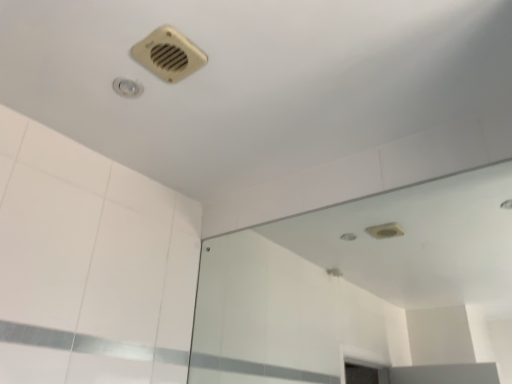
Question: Does transparent glass mirror at upper center have a lesser height compared to beige plastic air conditioning at upper center?

Choices:
 (A) yes
 (B) no

Answer: (B)

Question: Is the depth of transparent glass mirror at upper center greater than that of beige plastic air conditioning at upper center?

Choices:
 (A) no
 (B) yes

Answer: (A)

Question: From a real-world perspective, is transparent glass mirror at upper center positioned under beige plastic air conditioning at upper center based on gravity?

Choices:
 (A) no
 (B) yes

Answer: (B)

Question: From the image's perspective, is transparent glass mirror at upper center on beige plastic air conditioning at upper center?

Choices:
 (A) no
 (B) yes

Answer: (A)

Question: Is transparent glass mirror at upper center thinner than beige plastic air conditioning at upper center?

Choices:
 (A) no
 (B) yes

Answer: (B)

Question: Is transparent glass mirror at upper center far from beige plastic air conditioning at upper center?

Choices:
 (A) yes
 (B) no

Answer: (A)

Question: Is beige plastic air conditioning at upper center positioned beyond the bounds of transparent glass mirror at upper center?

Choices:
 (A) yes
 (B) no

Answer: (A)

Question: From the image's perspective, is beige plastic air conditioning at upper center over transparent glass mirror at upper center?

Choices:
 (A) yes
 (B) no

Answer: (A)

Question: Considering the relative sizes of beige plastic air conditioning at upper center and transparent glass mirror at upper center in the image provided, is beige plastic air conditioning at upper center taller than transparent glass mirror at upper center?

Choices:
 (A) yes
 (B) no

Answer: (B)

Question: Is beige plastic air conditioning at upper center not close to transparent glass mirror at upper center?

Choices:
 (A) yes
 (B) no

Answer: (A)

Question: Does beige plastic air conditioning at upper center have a lesser height compared to transparent glass mirror at upper center?

Choices:
 (A) no
 (B) yes

Answer: (B)

Question: Does beige plastic air conditioning at upper center have a larger size compared to transparent glass mirror at upper center?

Choices:
 (A) no
 (B) yes

Answer: (A)

Question: In terms of size, does transparent glass mirror at upper center appear bigger or smaller than beige plastic air conditioning at upper center?

Choices:
 (A) small
 (B) big

Answer: (B)